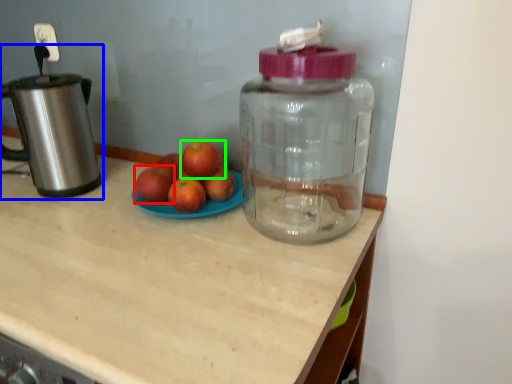
Question: Which is farther away from apple (highlighted by a red box)? kitchen appliance (highlighted by a blue box) or grapefruit (highlighted by a green box)?

Choices:
 (A) kitchen appliance
 (B) grapefruit

Answer: (A)